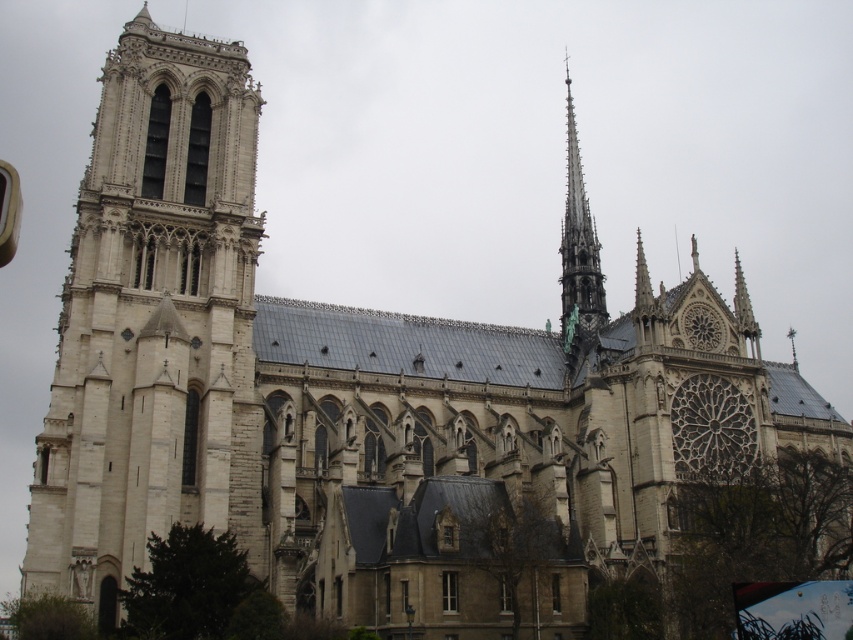
Can you confirm if white stone tower at left is shorter than smooth gray spire at upper right?

Yes.

Can you confirm if white stone tower at left is bigger than smooth gray spire at upper right?

No, white stone tower at left is not bigger than smooth gray spire at upper right.

Find the location of a particular element. The width and height of the screenshot is (853, 640). white stone tower at left is located at coordinates (154, 323).

Locate an element on the screen. white stone tower at left is located at coordinates (154, 323).